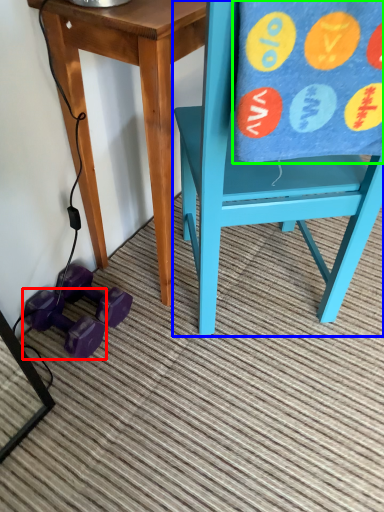
Question: Which object is positioned farthest from dumbbell (highlighted by a red box)? Select from chair (highlighted by a blue box) and beach towel (highlighted by a green box).

Choices:
 (A) chair
 (B) beach towel

Answer: (B)